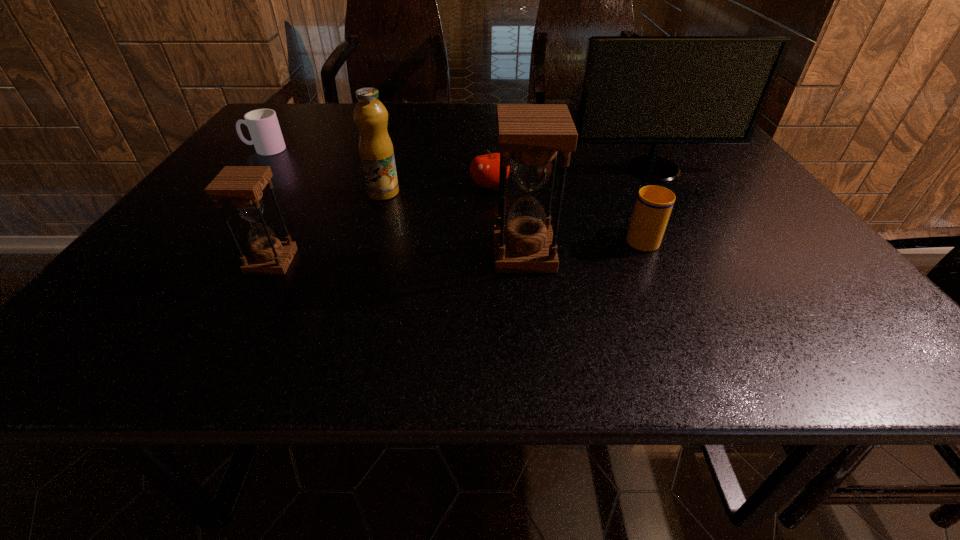
Locate an element on the screen. The width and height of the screenshot is (960, 540). vacant space at the far edge of the desktop is located at coordinates (520, 103).

Identify the location of blank space at the near edge. The image size is (960, 540). (725, 275).

Identify the location of vacant space at the left edge of the desktop. (169, 236).

Locate an element on the screen. The image size is (960, 540). free region at the right edge of the desktop is located at coordinates (761, 246).

Find the location of a particular element. The height and width of the screenshot is (540, 960). free point at the far left corner is located at coordinates (298, 119).

Find the location of a particular element. This screenshot has width=960, height=540. vacant space that is in between the third object from left to right and the leftmost object is located at coordinates (324, 171).

The image size is (960, 540). Identify the location of vacant area that lies between the leftmost object and the computer monitor. (459, 160).

The height and width of the screenshot is (540, 960). Find the location of `unoccupied position between the right hourglass and the left cup`. unoccupied position between the right hourglass and the left cup is located at coordinates (395, 201).

Locate an element on the screen. This screenshot has height=540, width=960. vacant area that lies between the farther cup and the computer monitor is located at coordinates (459, 160).

This screenshot has height=540, width=960. In order to click on free area in between the computer monitor and the apple in this screenshot , I will do `click(571, 178)`.